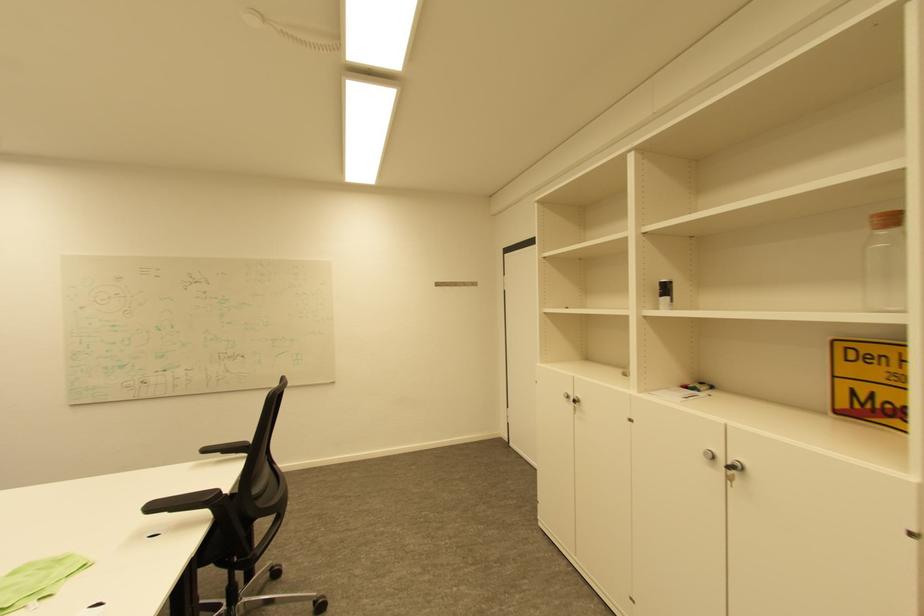
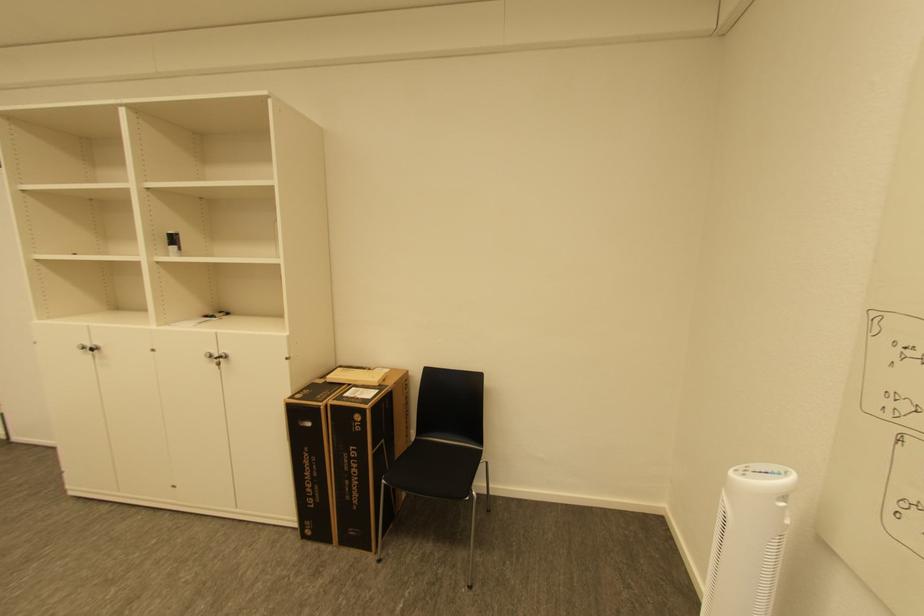
The point at (574, 398) is marked in the first image. Where is the corresponding point in the second image?

(91, 347)